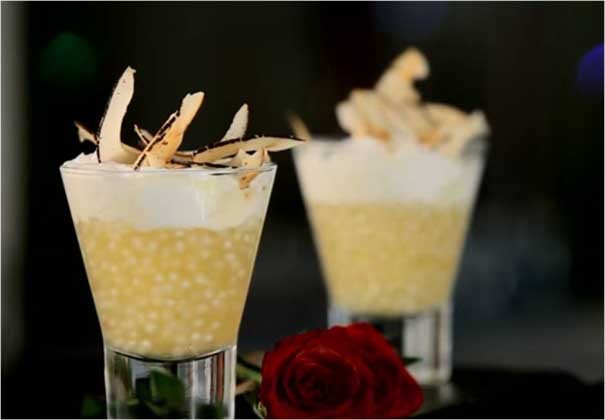
Image resolution: width=605 pixels, height=420 pixels. I want to click on thick glass base of dessert glass, so click(169, 391), click(429, 348).